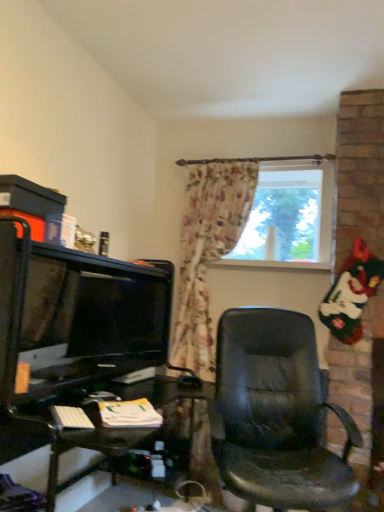
Question: Is transparent glass window at center thinner than matte black monitor at left?

Choices:
 (A) yes
 (B) no

Answer: (A)

Question: Is transparent glass window at center positioned behind matte black monitor at left?

Choices:
 (A) no
 (B) yes

Answer: (B)

Question: Does transparent glass window at center turn towards matte black monitor at left?

Choices:
 (A) no
 (B) yes

Answer: (A)

Question: Is transparent glass window at center located outside matte black monitor at left?

Choices:
 (A) no
 (B) yes

Answer: (B)

Question: Can you confirm if transparent glass window at center is shorter than matte black monitor at left?

Choices:
 (A) yes
 (B) no

Answer: (B)

Question: Considering the relative sizes of transparent glass window at center and matte black monitor at left in the image provided, is transparent glass window at center taller than matte black monitor at left?

Choices:
 (A) yes
 (B) no

Answer: (A)

Question: From a real-world perspective, does matte black monitor at left sit lower than transparent glass window at center?

Choices:
 (A) yes
 (B) no

Answer: (A)

Question: Considering the relative sizes of matte black monitor at left and transparent glass window at center in the image provided, is matte black monitor at left shorter than transparent glass window at center?

Choices:
 (A) no
 (B) yes

Answer: (B)

Question: Is transparent glass window at center located within matte black monitor at left?

Choices:
 (A) no
 (B) yes

Answer: (A)

Question: Could you tell me if matte black monitor at left is facing transparent glass window at center?

Choices:
 (A) no
 (B) yes

Answer: (A)

Question: Is matte black monitor at left positioned with its back to transparent glass window at center?

Choices:
 (A) no
 (B) yes

Answer: (A)

Question: Is matte black monitor at left further to camera compared to transparent glass window at center?

Choices:
 (A) yes
 (B) no

Answer: (B)

Question: From a real-world perspective, relative to matte black monitor at left, is transparent glass window at center vertically above or below?

Choices:
 (A) above
 (B) below

Answer: (A)